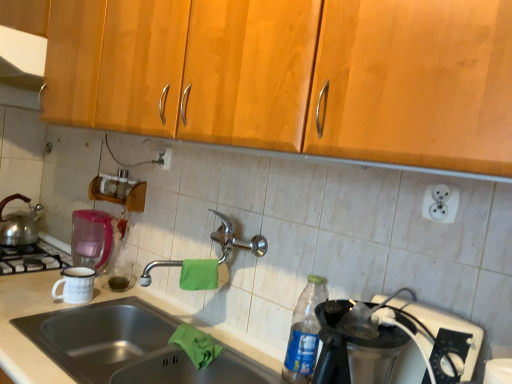
Question: Is point (74, 301) closer or farther from the camera than point (189, 345)?

Choices:
 (A) farther
 (B) closer

Answer: (A)

Question: From a real-world perspective, relative to green cloth at sink, the first material positioned from the bottom, is white enamel mug at left vertically above or below?

Choices:
 (A) below
 (B) above

Answer: (B)

Question: Considering the real-world distances, which object is farthest from the stainless steel sink at lower left?

Choices:
 (A) polished metal faucet at center
 (B) white plastic outlet at upper right, which is the first electric outlet from right to left
 (C) shiny silver tea pot at left
 (D) green cloth at center, acting as the 2th material starting from the bottom
 (E) clear plastic bottle at lower right

Answer: (C)

Question: Considering the real-world distances, which object is farthest from the polished metal faucet at center?

Choices:
 (A) shiny silver tea pot at left
 (B) green cloth at sink, which ranks as the second material in top-to-bottom order
 (C) clear plastic bottle at lower right
 (D) stainless steel sink at lower left
 (E) white plastic outlet at upper right, acting as the 2th electric outlet starting from the top

Answer: (A)